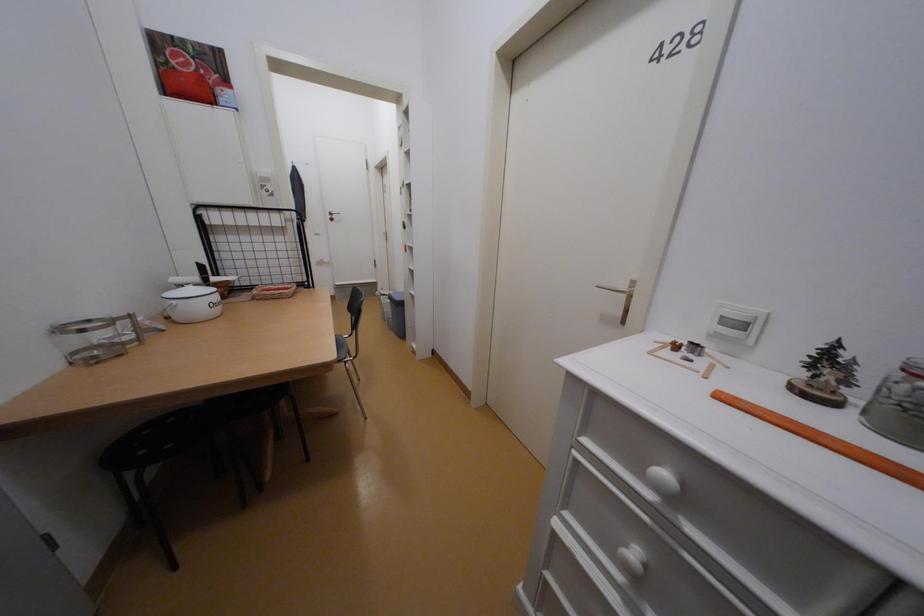
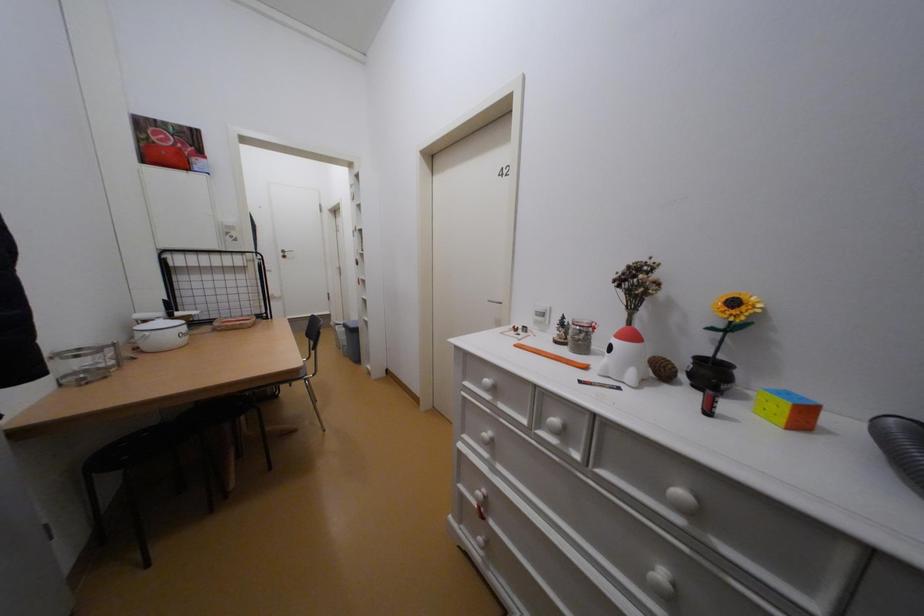
Question: The images are taken continuously from a first-person perspective. In which direction are you moving?

Choices:
 (A) Left
 (B) Right
 (C) Forward
 (D) Backward

Answer: (D)